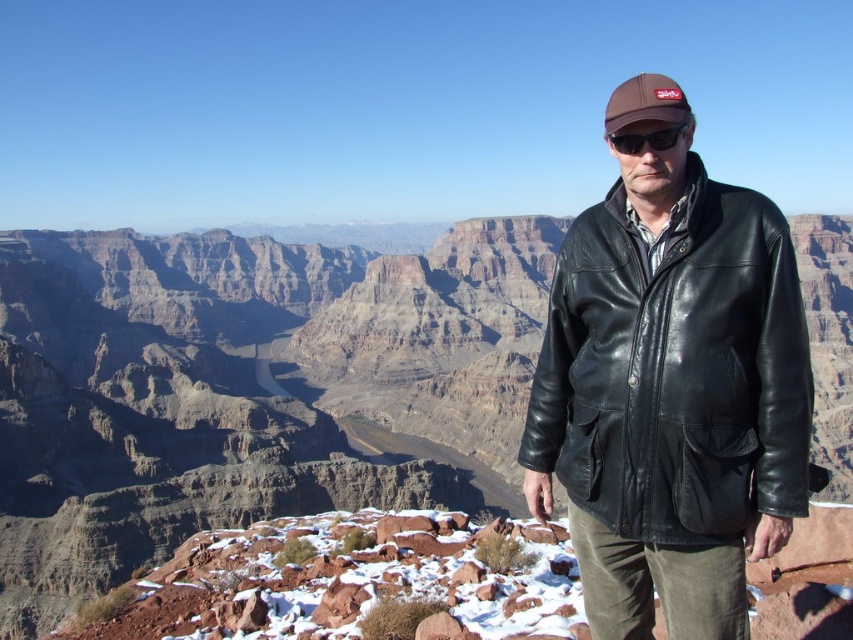
You are a photographer trying to capture the best shot of the canyon. You have two points marked on your viewfinder at coordinates point (x=666, y=106) and point (x=666, y=148). Which point is closer to the camera?

Point (x=666, y=106) is in front of point (x=666, y=148), so it is closer to the camera.

You are a photographer trying to capture a photo of the person at the Grand Canyon. The person is wearing a black leather jacket at right and a brown leather baseball hat at upper center. Which item is lower in the image?

The black leather jacket at right is positioned under the brown leather baseball hat at upper center, so the jacket is lower in the image.